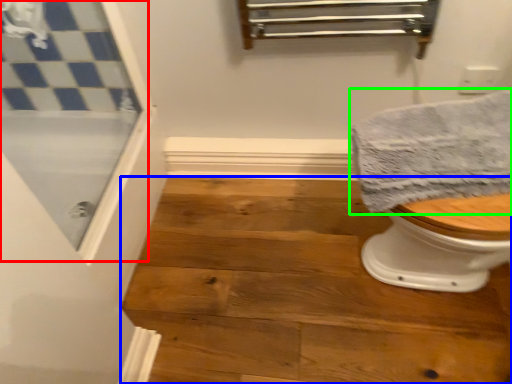
Question: Estimate the real-world distances between objects in this image. Which object is farther from screen door (highlighted by a red box), stair (highlighted by a blue box) or towel (highlighted by a green box)?

Choices:
 (A) stair
 (B) towel

Answer: (B)